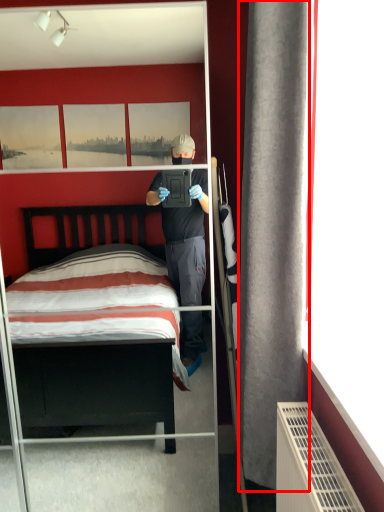
Question: From the image's perspective, where is curtain (annotated by the red box) located relative to mirror?

Choices:
 (A) below
 (B) above

Answer: (B)